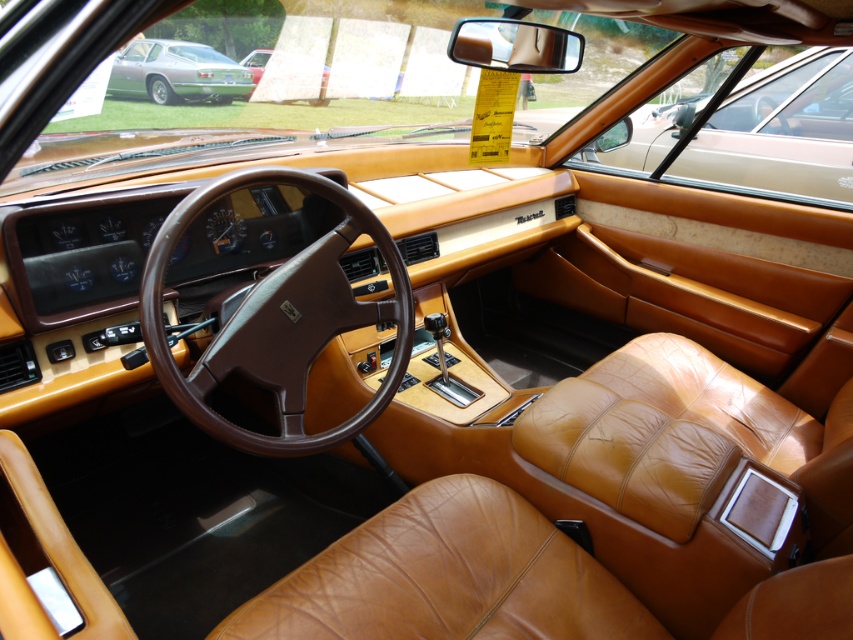
Does tan leather door at upper right have a greater height compared to green matte sports car at upper left?

Indeed, tan leather door at upper right has a greater height compared to green matte sports car at upper left.

Is tan leather door at upper right bigger than green matte sports car at upper left?

Indeed, tan leather door at upper right has a larger size compared to green matte sports car at upper left.

Who is more distant from viewer, (772, 141) or (155, 90)?

The point (155, 90) is more distant.

Find the location of a particular element. The height and width of the screenshot is (640, 853). tan leather door at upper right is located at coordinates (780, 132).

Can you confirm if brown leather steering wheel at center is bigger than matte red car at upper center?

Indeed, brown leather steering wheel at center has a larger size compared to matte red car at upper center.

In the scene shown: Does brown leather steering wheel at center appear over matte red car at upper center?

Incorrect, brown leather steering wheel at center is not positioned above matte red car at upper center.

Is point (225, 436) positioned behind point (265, 49)?

No, it is in front of (265, 49).

Where is `brown leather steering wheel at center`? This screenshot has width=853, height=640. brown leather steering wheel at center is located at coordinates (277, 321).

Looking at this image, can you confirm if green matte sports car at upper left is positioned below matte red car at upper center?

Correct, green matte sports car at upper left is located below matte red car at upper center.

Is point (213, 83) less distant than point (257, 52)?

No, it is not.

Where is `green matte sports car at upper left`? This screenshot has width=853, height=640. green matte sports car at upper left is located at coordinates (177, 72).